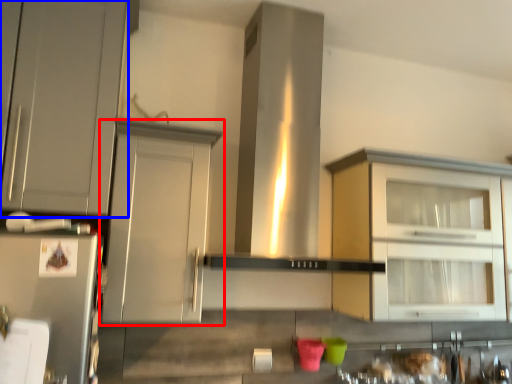
Question: Which object appears closest to the camera in this image, cabinetry (highlighted by a red box) or cabinetry (highlighted by a blue box)?

Choices:
 (A) cabinetry
 (B) cabinetry

Answer: (B)